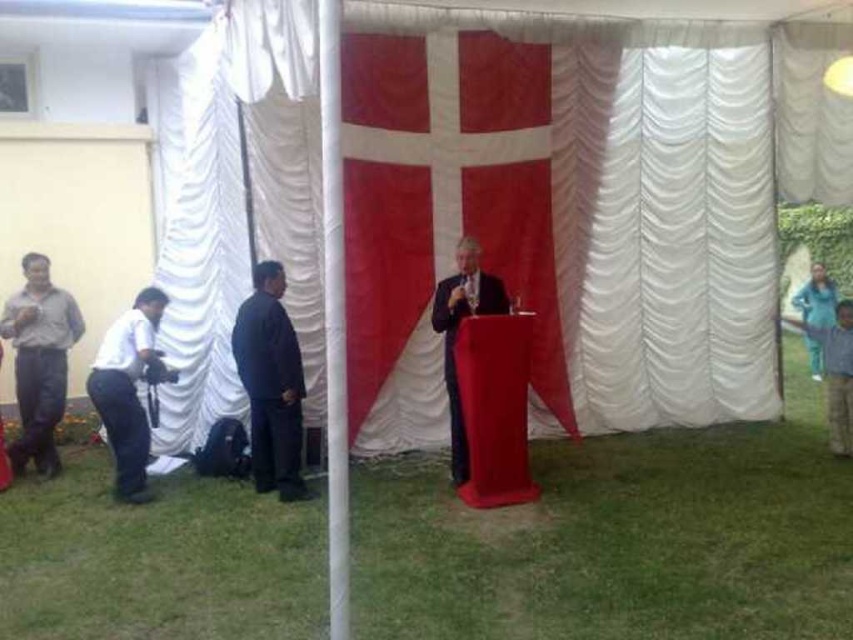
You are a photographer planning to capture the scene under the tent. You notice the gray matte pants at left and the blue fabric at right. Which object should you focus on if you want to capture the narrower one?

The gray matte pants at left has a lesser width compared to blue fabric at right, so you should focus on the gray matte pants at left to capture the narrower one.

You are standing at the entrance of the tent and want to find the white satin curtain at center. According to the coordinates provided, in which direction should you move from your current position to locate it?

The white satin curtain at center is located at point 0.383 on the x axis and 0.800 on the y axis. Since you are at the entrance, which is likely at the front of the tent, moving towards the center area would involve moving forward along the tent towards the higher y coordinate. However, the exact direction depends on the tent layout, but based on coordinates, moving towards the center horizontally at 0.383 x and up to 0.8 y would be the path.